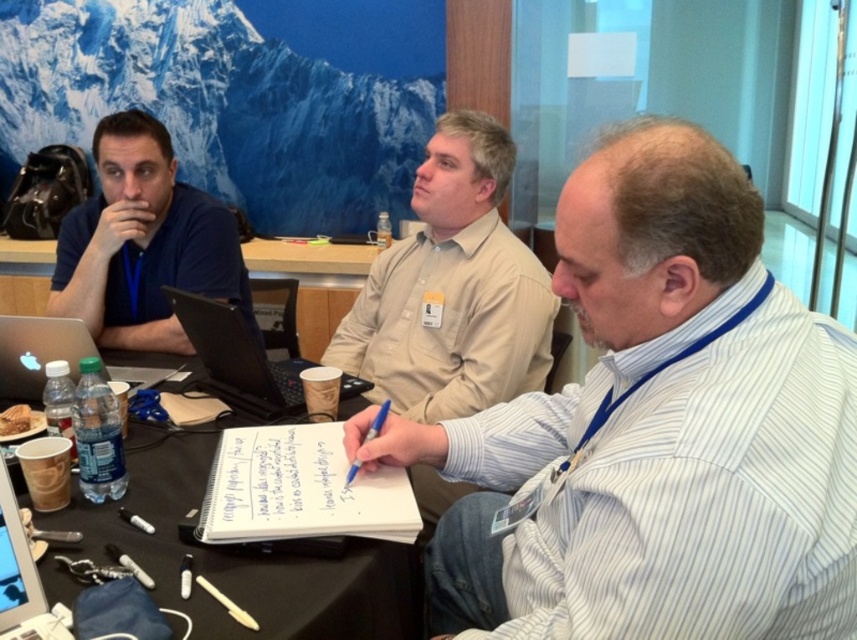
Based on the photo, you are standing in the conference room and want to walk from point A to point B. Point A is at coordinates point (33, 403) and point B is at point (40, 632). Which point is closer to you when you start walking?

Point (33, 403) is closer to you than point (40, 632) because it is further to the viewer.

You are organizing a meeting in a conference room. You need to present a detailed report using the silver metallic laptop at left and the silver metallic laptop at center. Which laptop should you choose if you want the one with a larger screen for better visibility?

The silver metallic laptop at left is bigger than the silver metallic laptop at center, so you should choose the silver metallic laptop at left for better visibility due to its larger screen.